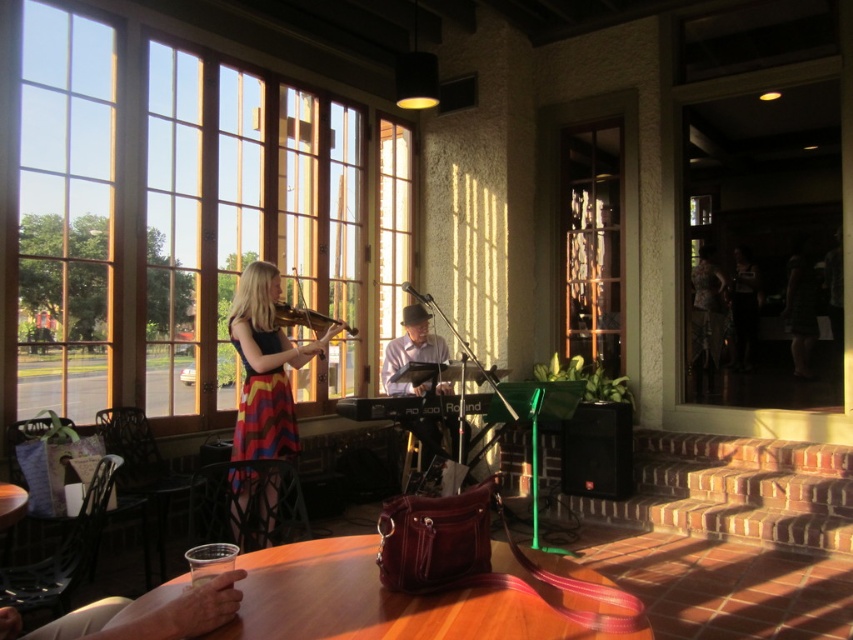
You are sitting at the table in the image and want to see outside through the clear glass window at left. Can you see the multicolored fabric dress at center in your direct line of sight when looking through the window?

The clear glass window at left is located above the multicolored fabric dress at center, so when looking through the window, the dress would block part of your view. Therefore, you cannot see the multicolored fabric dress at center in your direct line of sight through the window.

You are a painter standing in the room and want to place a large canvas between the clear glass window at left and the multicolored fabric dress at center. Can you fit the canvas between them if the canvas is 1.2 meters wide?

The clear glass window at left might be wider than multicolored fabric dress at center, but without knowing the exact width of the window and dress, it is uncertain if the 1.2 meter canvas will fit between them.